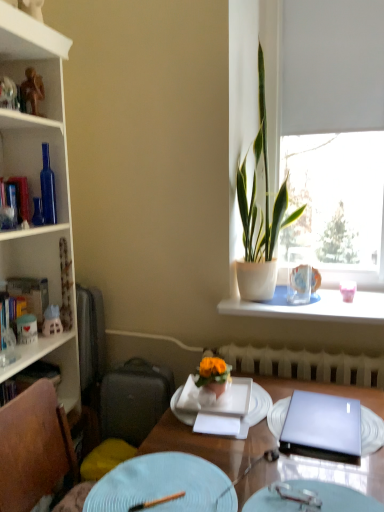
Question: Does hardcover book at left, which is the 2th book in bottom-to-top order, have a greater height compared to white plastic radiator at lower center?

Choices:
 (A) no
 (B) yes

Answer: (B)

Question: From a real-world perspective, is hardcover book at left, which appears as the second book when viewed from the top, over white plastic radiator at lower center?

Choices:
 (A) no
 (B) yes

Answer: (B)

Question: Is the surface of hardcover book at left, which is the 2th book in bottom-to-top order, in direct contact with white plastic radiator at lower center?

Choices:
 (A) no
 (B) yes

Answer: (A)

Question: From the image's perspective, would you say hardcover book at left, which appears as the second book when viewed from the top, is shown under white plastic radiator at lower center?

Choices:
 (A) yes
 (B) no

Answer: (B)

Question: Considering the relative sizes of hardcover book at left, which is the 2th book in bottom-to-top order, and white plastic radiator at lower center in the image provided, is hardcover book at left, which is the 2th book in bottom-to-top order, shorter than white plastic radiator at lower center?

Choices:
 (A) yes
 (B) no

Answer: (B)

Question: From a real-world perspective, is wooden chopstick at lower center, acting as the 3th tableware starting from the back, positioned above or below white glossy bookcase at left?

Choices:
 (A) below
 (B) above

Answer: (A)

Question: From their relative heights in the image, would you say wooden chopstick at lower center, which appears as the 3th tableware when viewed from the right, is taller or shorter than white glossy bookcase at left?

Choices:
 (A) short
 (B) tall

Answer: (A)

Question: Does point (162, 498) appear closer or farther from the camera than point (8, 367)?

Choices:
 (A) closer
 (B) farther

Answer: (A)

Question: From the image's perspective, is wooden chopstick at lower center, acting as the 3th tableware starting from the back, above or below white glossy bookcase at left?

Choices:
 (A) below
 (B) above

Answer: (A)

Question: Is white ceramic vase at upper right taller or shorter than white matte window at upper right?

Choices:
 (A) short
 (B) tall

Answer: (A)

Question: Is white ceramic vase at upper right inside the boundaries of white matte window at upper right, or outside?

Choices:
 (A) outside
 (B) inside

Answer: (A)

Question: In the image, is white ceramic vase at upper right on the left side or the right side of white matte window at upper right?

Choices:
 (A) right
 (B) left

Answer: (B)

Question: From a real-world perspective, is white ceramic vase at upper right positioned above or below white matte window at upper right?

Choices:
 (A) above
 (B) below

Answer: (B)

Question: Would you say white plastic radiator at lower center is to the left or to the right of light blue textured plate at lower center, which appears as the first plate when viewed from the front, in the picture?

Choices:
 (A) right
 (B) left

Answer: (A)

Question: Is white plastic radiator at lower center wider or thinner than light blue textured plate at lower center, which appears as the first plate when viewed from the front?

Choices:
 (A) wide
 (B) thin

Answer: (B)